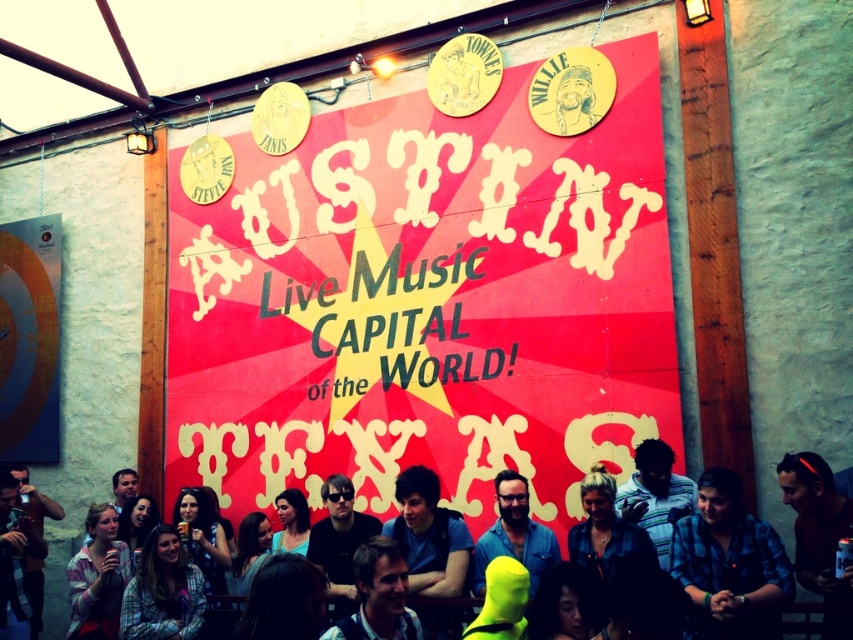
You are a photographer setting up a tripod to capture the banner and the faces of the musicians. You notice two elements at the center of your viewfinder, the smooth skin face at center and the matte black shirt at center. Which element is shorter in height?

The smooth skin face at center has a lesser height compared to matte black shirt at center, so the smooth skin face at center is shorter in height.

You are a photographer at the music venue and need to know which object is taller between the red matte poster at center and the neon yellow wig at lower center. Can you determine this based on their positions?

The red matte poster at center is not as tall as the neon yellow wig at lower center, so the neon yellow wig at lower center is taller.

You are a photographer at the music venue in Austin, Texas. You need to place a spotlight exactly at the center of the smooth skin face at center. What are the coordinates where you should aim the spotlight?

The coordinates for the center of the smooth skin face at center are at point (378, 595).